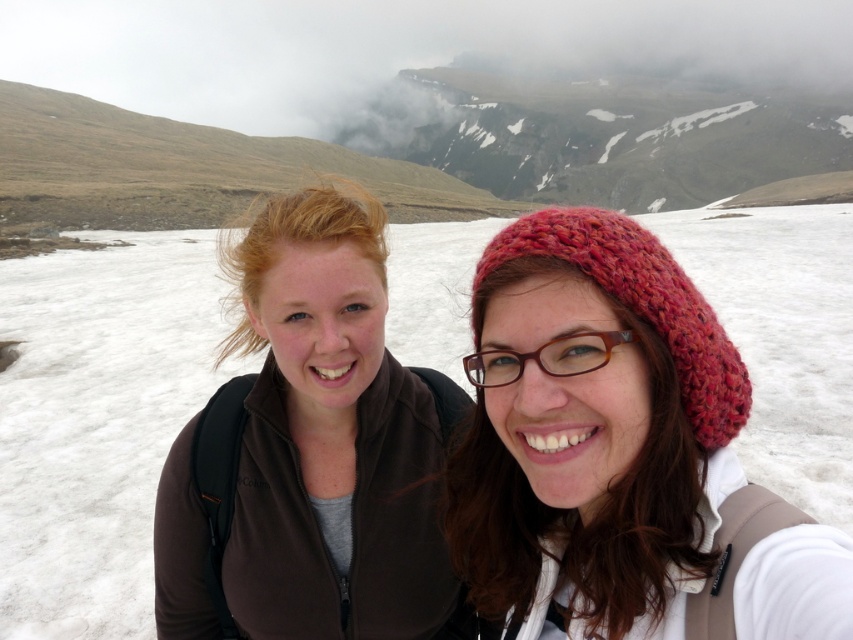
You are standing in a snowy landscape and want to place a 10 meter long rope between the two people. The rope must be anchored at the white fluffy snow at center. Is the snow far enough away to allow the rope to stretch between the two people?

The white fluffy snow at center is 8.29 meters from viewer. Since the rope is 10 meters long, the snow is not far enough to allow the rope to stretch between the two people.

You are planning to take a photo of the two hikers in the snowy landscape. You want to ensure that both the brown fleece jacket at center and the brown plastic glasses at center are clearly visible in the photo. Based on their positions, do you think the glasses will be obscured by the jacket?

The brown fleece jacket at center is positioned over the brown plastic glasses at center, so the glasses will be obscured by the jacket in the photo.

Consider the image. You are planning to take a photo of the white fluffy snow at center and the knitted woolen hat at right. Which object should you focus on first if you want both to be in sharp focus?

The white fluffy snow at center is positioned over the knitted woolen hat at right, so focusing on the white fluffy snow at center first will ensure both are in sharp focus.